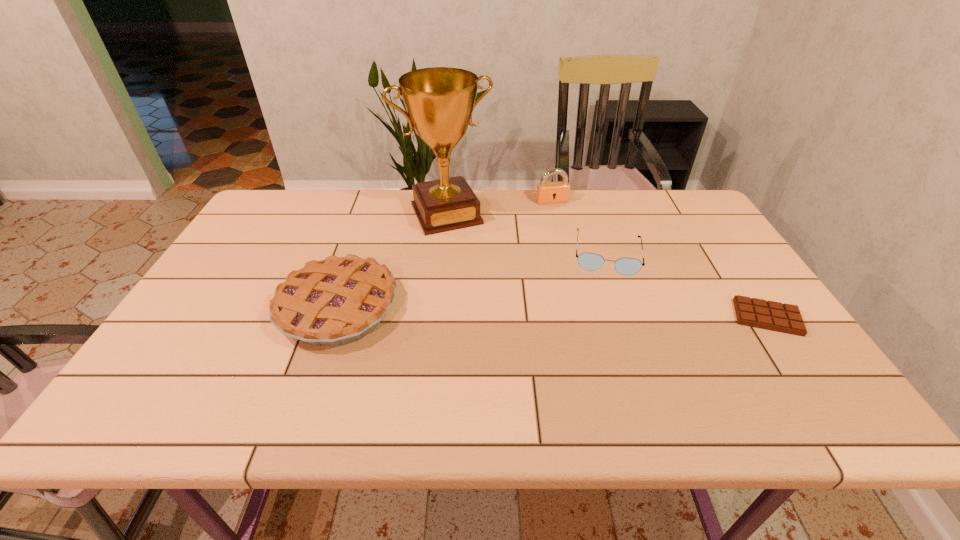
Locate an element on the screen. The height and width of the screenshot is (540, 960). free spot between the spectacles and the pie is located at coordinates (472, 281).

Where is `empty location between the award and the pie`? The width and height of the screenshot is (960, 540). empty location between the award and the pie is located at coordinates (393, 261).

Find the location of a particular element. empty space between the rightmost object and the padlock is located at coordinates (660, 259).

You are a GUI agent. You are given a task and a screenshot of the screen. Output one action in this format:
    pyautogui.click(x=<x>, y=<y>)
    Task: Click on the empty space that is in between the pie and the fourth shortest object
    Image resolution: width=960 pixels, height=540 pixels.
    Given the screenshot: What is the action you would take?
    pyautogui.click(x=445, y=254)

Find the location of `unoccupied area between the fourth shortest object and the award`. unoccupied area between the fourth shortest object and the award is located at coordinates (499, 207).

Find the location of a particular element. free space that is in between the padlock and the pie is located at coordinates pyautogui.click(x=445, y=254).

I want to click on empty space that is in between the tallest object and the candy bar, so click(x=607, y=266).

Locate which object ranks second in proximity to the fourth shortest object. Please provide its 2D coordinates. Your answer should be formatted as a tuple, i.e. [(x, y)], where the tuple contains the x and y coordinates of a point satisfying the conditions above.

[(589, 261)]

In order to click on object that stands as the third closest to the spectacles in this screenshot , I will do `click(439, 101)`.

Locate an element on the screen. The image size is (960, 540). vacant space that satisfies the following two spatial constraints: 1. on the back side of the pie; 2. on the left side of the spectacles is located at coordinates (356, 254).